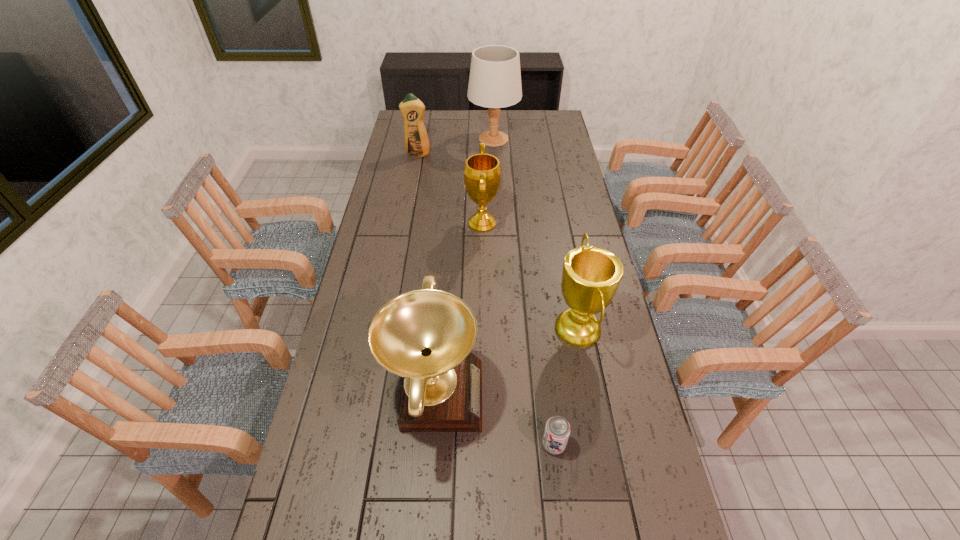
Identify the location of table lamp. (495, 79).

Image resolution: width=960 pixels, height=540 pixels. Find the location of `detergent`. detergent is located at coordinates pyautogui.click(x=416, y=139).

Locate an element on the screen. Image resolution: width=960 pixels, height=540 pixels. the farthest award is located at coordinates (482, 172).

Where is `the rightmost award`? the rightmost award is located at coordinates (591, 275).

Find the location of `beer can`. beer can is located at coordinates (557, 430).

In order to click on free region located 0.140m on the left of the table lamp in this screenshot , I will do `click(441, 139)`.

Find the location of `vacant area located on the label of the detergent`. vacant area located on the label of the detergent is located at coordinates (412, 188).

This screenshot has width=960, height=540. What are the coordinates of `vacant space located on the front-facing side of the third farthest object` in the screenshot? It's located at (422, 224).

The height and width of the screenshot is (540, 960). Identify the location of vacant position located on the front-facing side of the third farthest object. (435, 224).

Image resolution: width=960 pixels, height=540 pixels. I want to click on free space located on the front-facing side of the third farthest object, so click(x=415, y=224).